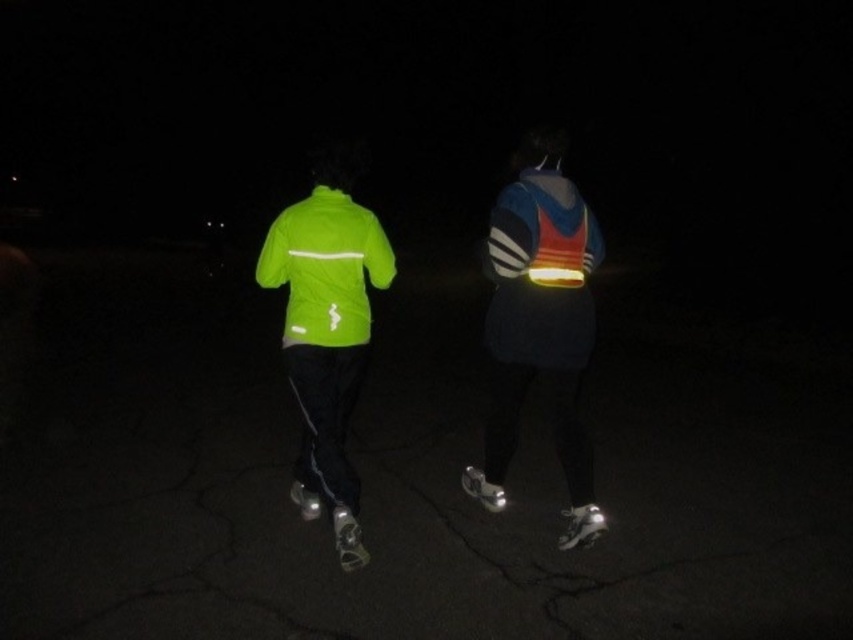
Is point (564, 412) farther from viewer compared to point (312, 337)?

Yes, it is behind point (312, 337).

Who is shorter, reflective blue jacket at center or neon green fabric jacket at upper left?

neon green fabric jacket at upper left

Which is in front, point (500, 216) or point (363, 282)?

Point (500, 216) is in front.

At what (x,y) coordinates should I click in order to perform the action: click on reflective blue jacket at center. Please return your answer as a coordinate pair (x, y). Image resolution: width=853 pixels, height=640 pixels. Looking at the image, I should click on (538, 323).

Which is above, reflective blue jacket at center or neon green jacket at center?

Positioned higher is reflective blue jacket at center.

Between reflective blue jacket at center and neon green jacket at center, which one has less height?

Standing shorter between the two is neon green jacket at center.

Who is more distant from viewer, (512,387) or (279,227)?

The point (512,387) is more distant.

Where is `reflective blue jacket at center`? This screenshot has width=853, height=640. reflective blue jacket at center is located at coordinates (538, 323).

Between point (521, 154) and point (346, 561), which one is positioned behind?

The point (521, 154) is more distant.

Which is above, reflective blue jacket at center or shiny silver roller skate at lower center?

Positioned higher is reflective blue jacket at center.

Between point (538, 292) and point (340, 540), which one is positioned in front?

Point (340, 540) is in front.

At what (x,y) coordinates should I click in order to perform the action: click on reflective blue jacket at center. Please return your answer as a coordinate pair (x, y). Image resolution: width=853 pixels, height=640 pixels. Looking at the image, I should click on (538, 323).